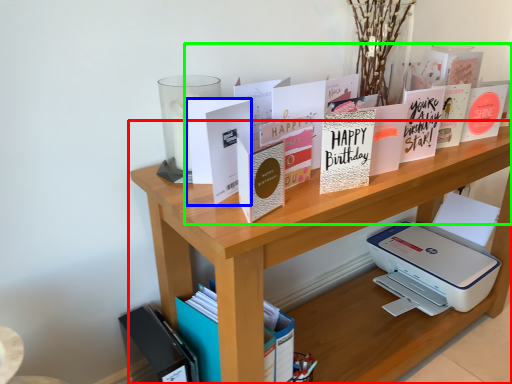
Question: Which object is positioned closest to shelf (highlighted by a red box)? Select from paperback book (highlighted by a blue box) and book (highlighted by a green box).

Choices:
 (A) paperback book
 (B) book

Answer: (A)